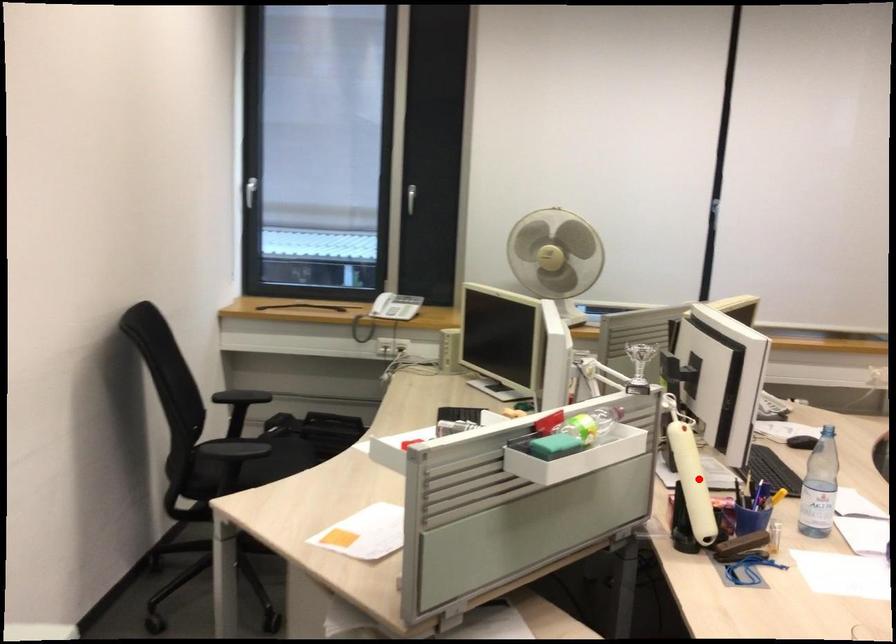
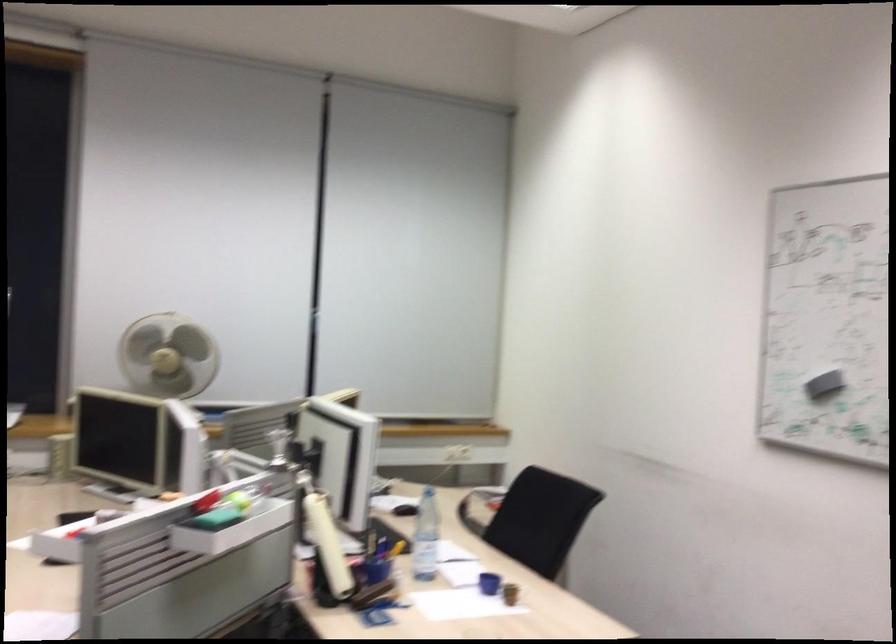
Question: I am providing you with two images of the same scene from different viewpoints. A red point is shown in image1. For the corresponding object point in image2, is it positioned nearer or farther from the camera?

Choices:
 (A) Nearer
 (B) Farther

Answer: (B)